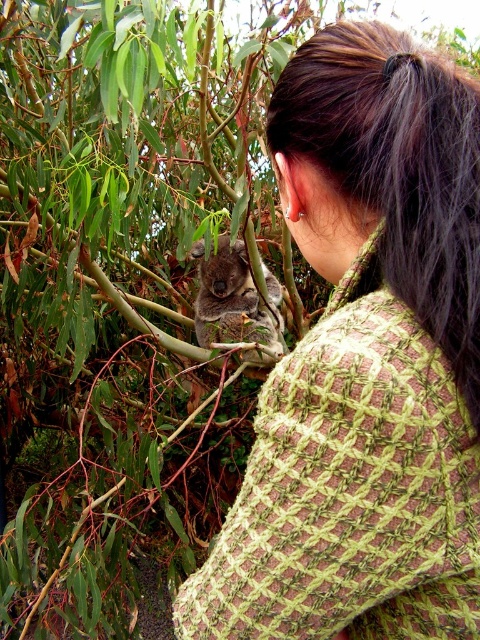
You are a photographer trying to capture the gray furry koala at upper center without any obstructions. However, the linen green shawl at upper right is blocking your view. Can you move the shawl to the side to get a clear shot?

The linen green shawl at upper right is in front of the gray furry koala at upper center, so moving the shawl to the side would allow you to see the gray furry koala at upper center clearly.

Looking at this image, you are a photographer trying to capture the gray furry koala at upper center and the linen green shawl at upper right in the same frame. Based on their positions, which object is closer to the camera?

The gray furry koala at upper center is closer to the camera because the linen green shawl at upper right is below it, indicating it is positioned further back in the scene.